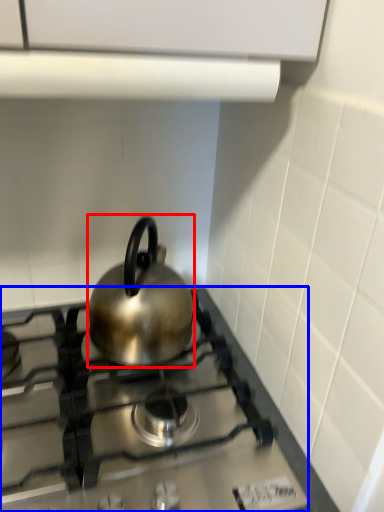
Question: Among these objects, which one is farthest to the camera, kettle (highlighted by a red box) or gas stove (highlighted by a blue box)?

Choices:
 (A) kettle
 (B) gas stove

Answer: (A)